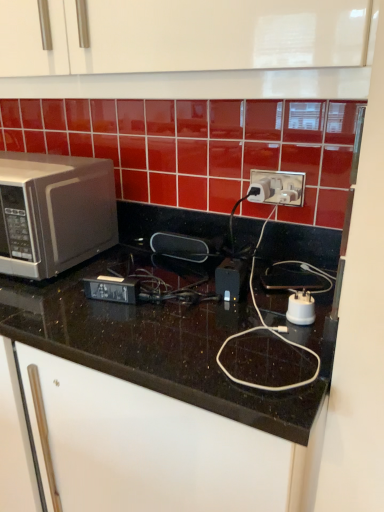
Question: Is white plastic power plugs and sockets at center located within satin silver microwave at left?

Choices:
 (A) yes
 (B) no

Answer: (B)

Question: Is satin silver microwave at left positioned before white plastic power plugs and sockets at center?

Choices:
 (A) no
 (B) yes

Answer: (B)

Question: From a real-world perspective, is satin silver microwave at left beneath white plastic power plugs and sockets at center?

Choices:
 (A) no
 (B) yes

Answer: (B)

Question: From the image's perspective, would you say satin silver microwave at left is shown under white plastic power plugs and sockets at center?

Choices:
 (A) yes
 (B) no

Answer: (A)

Question: Does satin silver microwave at left lie behind white plastic power plugs and sockets at center?

Choices:
 (A) yes
 (B) no

Answer: (B)

Question: Is satin silver microwave at left taller than white plastic power plugs and sockets at center?

Choices:
 (A) no
 (B) yes

Answer: (B)

Question: Does white plastic plug at center, the 2th appliance from the top, have a smaller size compared to white plastic power plugs and sockets at center?

Choices:
 (A) no
 (B) yes

Answer: (B)

Question: Is there a large distance between white plastic plug at center, acting as the 2th appliance starting from the back, and white plastic power plugs and sockets at center?

Choices:
 (A) yes
 (B) no

Answer: (B)

Question: Is white plastic plug at center, the 2th appliance from the top, to the left of white plastic power plugs and sockets at center from the viewer's perspective?

Choices:
 (A) no
 (B) yes

Answer: (B)

Question: Is white plastic plug at center, arranged as the 1th appliance when viewed from the front, aimed at white plastic power plugs and sockets at center?

Choices:
 (A) yes
 (B) no

Answer: (B)

Question: Is white plastic plug at center, the 2th appliance from the top, closer to the viewer compared to white plastic power plugs and sockets at center?

Choices:
 (A) yes
 (B) no

Answer: (A)

Question: Does white plastic plug at center, which appears as the first appliance when ordered from the bottom, have a lesser width compared to white plastic power plugs and sockets at center?

Choices:
 (A) no
 (B) yes

Answer: (A)

Question: From a real-world perspective, is satin silver microwave at left below white plastic plug at center, marked as the 1th appliance in a right-to-left arrangement?

Choices:
 (A) no
 (B) yes

Answer: (A)